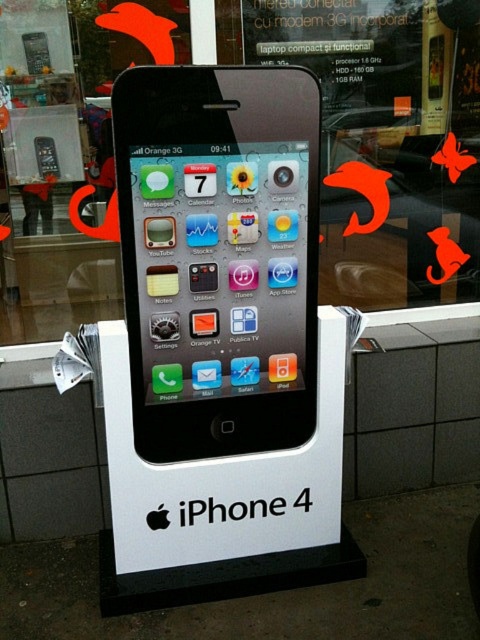
You are a customer at the retail store and see both the matte black iphone 4 at center and the matte black phone at center displayed on stands. Which one is taller?

The matte black iphone 4 at center is taller than the matte black phone at center.